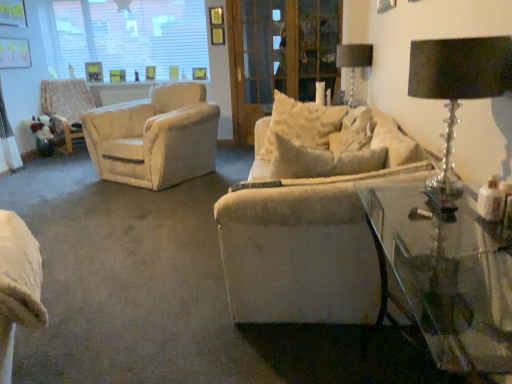
Question: From the image's perspective, relative to white textured chair at left, is transparent glass window at upper left above or below?

Choices:
 (A) below
 (B) above

Answer: (B)

Question: In terms of width, does transparent glass window at upper left look wider or thinner when compared to white textured chair at left?

Choices:
 (A) wide
 (B) thin

Answer: (B)

Question: Which object is the closest to the black crystal table lamp at upper right, which appears as the 2th table lamp when viewed from the back?

Choices:
 (A) metallic glass table lamp at upper right, the first table lamp when ordered from back to front
 (B) white textured chair at left
 (C) transparent glass window at upper left
 (D) transparent glass table at lower right
 (E) wooden screen door at center

Answer: (D)

Question: Considering the real-world distances, which object is closest to the white textured chair at left?

Choices:
 (A) transparent glass table at lower right
 (B) black crystal table lamp at upper right, arranged as the 2th table lamp when viewed from the top
 (C) transparent glass window at upper left
 (D) metallic glass table lamp at upper right, marked as the second table lamp in a front-to-back arrangement
 (E) wooden screen door at center

Answer: (C)